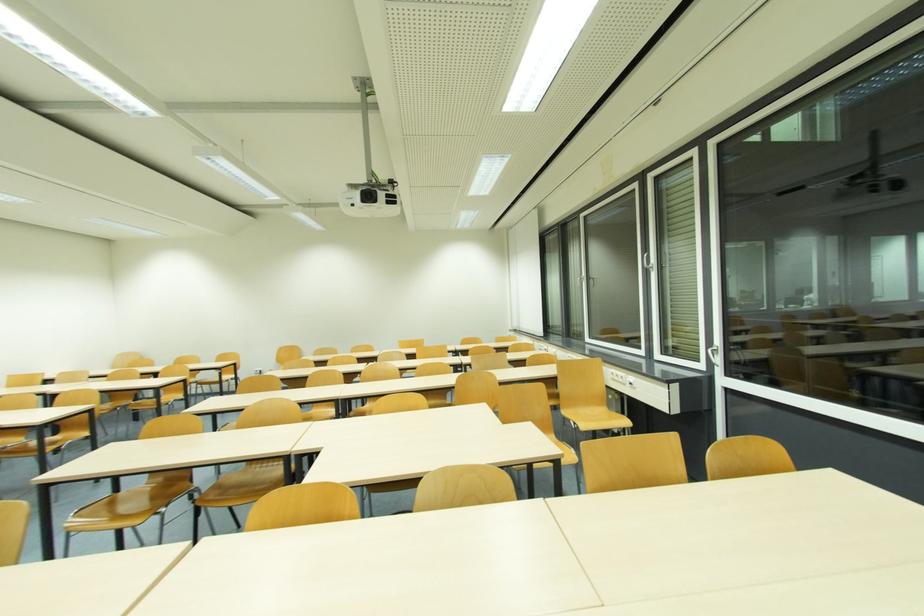
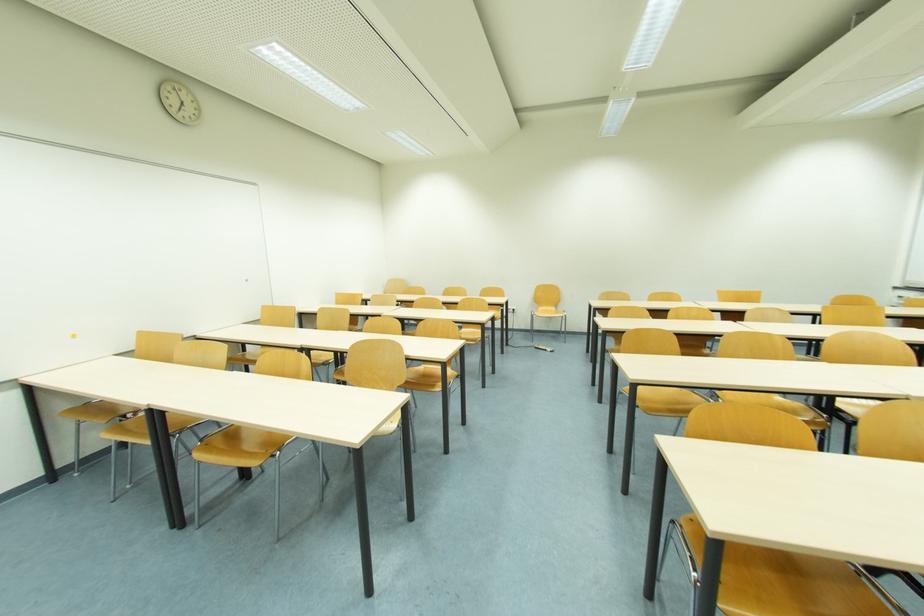
Question: In a continuous first-person perspective shot, in which direction is the camera moving?

Choices:
 (A) Left
 (B) Right
 (C) Forward
 (D) Backward

Answer: (A)